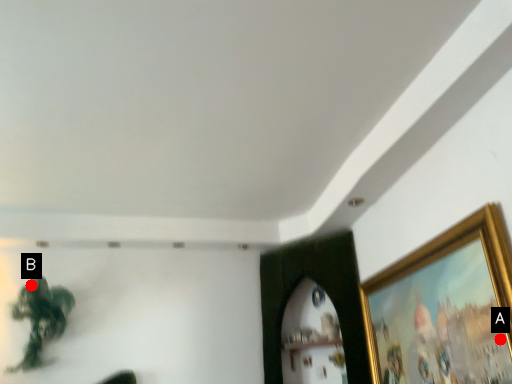
Question: Two points are circled on the image, labeled by A and B beside each circle. Which point is farther to the camera?

Choices:
 (A) A is further
 (B) B is further

Answer: (B)